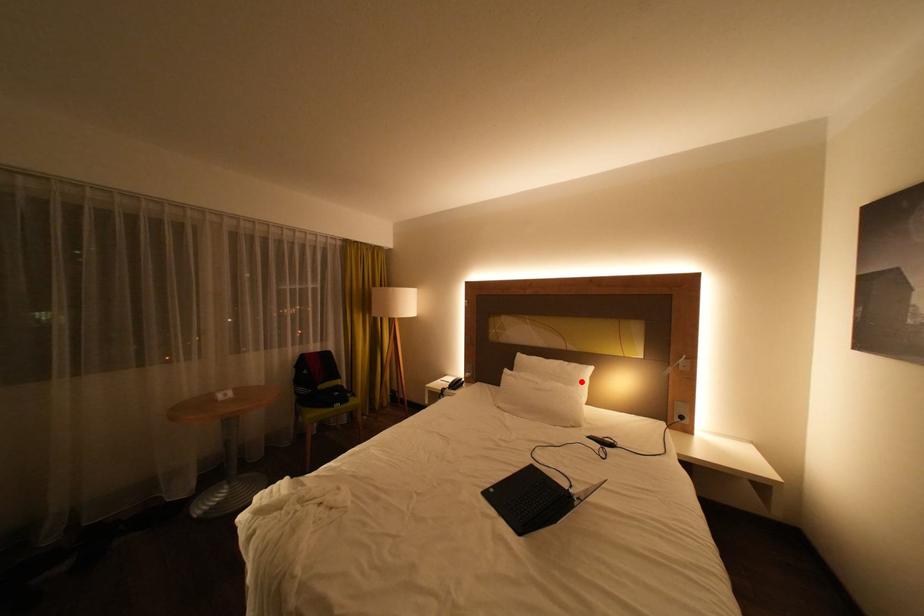
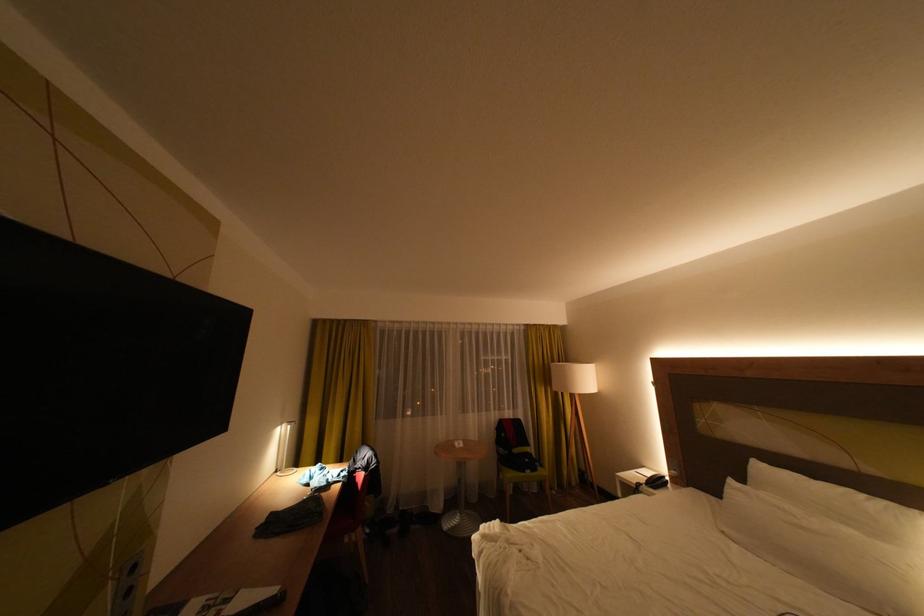
Question: I am providing you with two images of the same scene from different viewpoints. A red point is shown in image1. For the corresponding object point in image2, is it positioned nearer or farther from the camera?

Choices:
 (A) Nearer
 (B) Farther

Answer: (A)